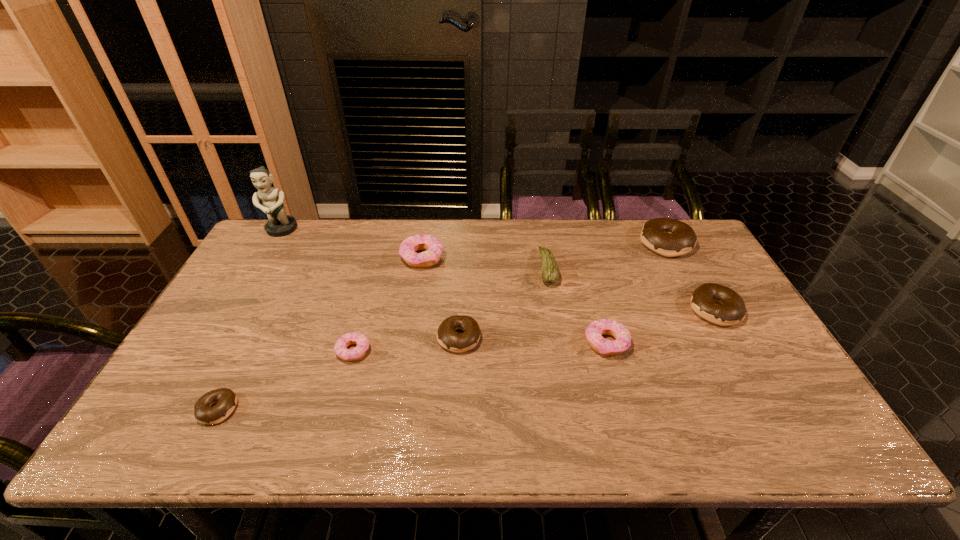
In order to click on free location at the near right corner in this screenshot , I will do `click(772, 436)`.

What are the coordinates of `free space between the third smallest brown doughnut and the zucchini` in the screenshot? It's located at (632, 289).

Identify the location of vacant point located between the sixth doughnut from right to left and the green zucchini. coord(450,309).

The width and height of the screenshot is (960, 540). I want to click on vacant area that lies between the second smallest pink doughnut and the leftmost doughnut, so pos(412,376).

At what (x,y) coordinates should I click in order to perform the action: click on free spot between the fifth doughnut from right to left and the green figurine. Please return your answer as a coordinate pair (x, y). Looking at the image, I should click on (351, 244).

You are a GUI agent. You are given a task and a screenshot of the screen. Output one action in this format:
    pyautogui.click(x=<x>, y=<y>)
    Task: Click on the vacant area that lies between the second tallest object and the seventh object from right to left
    
    Given the screenshot: What is the action you would take?
    pyautogui.click(x=510, y=297)

Where is `empty space between the nearest object and the third smallest brown doughnut`? The image size is (960, 540). empty space between the nearest object and the third smallest brown doughnut is located at coordinates (467, 360).

Locate an element on the screen. The image size is (960, 540). empty space that is in between the fifth object from right to left and the figurine is located at coordinates (370, 284).

Find the location of a particular element. The image size is (960, 540). unoccupied area between the third doughnut from right to left and the smallest brown doughnut is located at coordinates (412, 376).

Locate which object ranks eighth in proximity to the smallest brown doughnut. Please provide its 2D coordinates. Your answer should be formatted as a tuple, i.e. [(x, y)], where the tuple contains the x and y coordinates of a point satisfying the conditions above.

[(668, 237)]